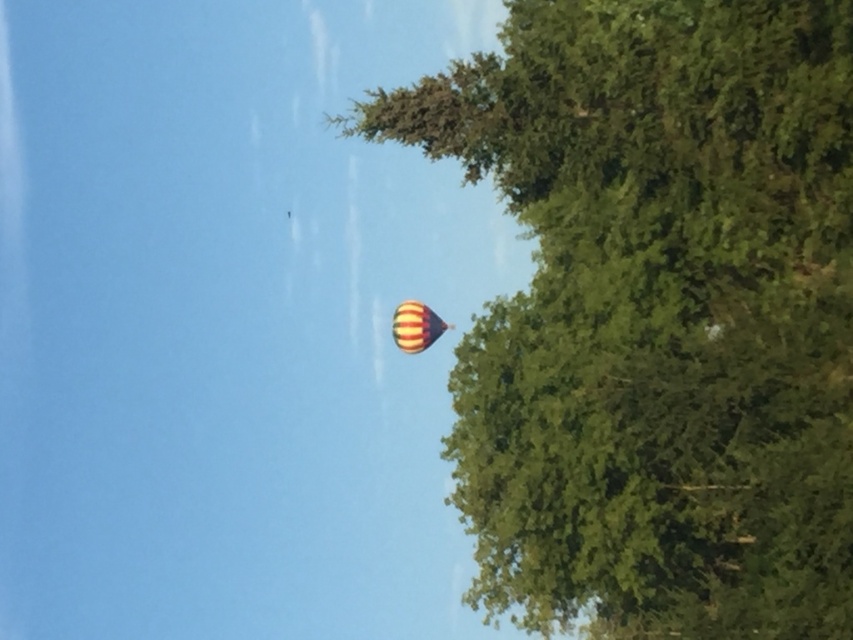
Question: Which point appears farthest from the camera in this image?

Choices:
 (A) (668, 502)
 (B) (397, 314)

Answer: (B)

Question: Is green leafy tree at upper right thinner than striped fabric balloon at upper center?

Choices:
 (A) yes
 (B) no

Answer: (B)

Question: Is green leafy tree at upper right smaller than striped fabric balloon at upper center?

Choices:
 (A) no
 (B) yes

Answer: (A)

Question: Is green leafy tree at upper right smaller than striped fabric balloon at upper center?

Choices:
 (A) yes
 (B) no

Answer: (B)

Question: Which point is closer to the camera taking this photo?

Choices:
 (A) (701, 516)
 (B) (397, 346)

Answer: (A)